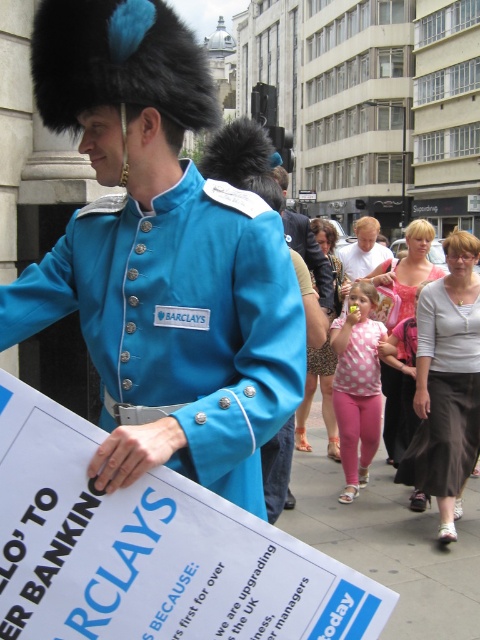
How distant is pink fabric dress at center from light brown hair at center?

The distance of pink fabric dress at center from light brown hair at center is 96.15 centimeters.

Is point (376, 284) closer to viewer compared to point (360, 228)?

Yes, point (376, 284) is closer to viewer.

Locate an element on the screen. The height and width of the screenshot is (640, 480). pink fabric dress at center is located at coordinates (408, 269).

Is light gray cotton skirt at lower right taller than pink fabric dress at center?

No, light gray cotton skirt at lower right is not taller than pink fabric dress at center.

Is point (460, 316) positioned behind point (404, 301)?

That is False.

Between point (471, 257) and point (437, 272), which one is positioned behind?

Point (437, 272)

Locate an element on the screen. light gray cotton skirt at lower right is located at coordinates (446, 385).

Who is more forward, (391, 384) or (308, 352)?

Point (308, 352) is more forward.

Does pink fabric dress at center come in front of leopard print dress at center?

Yes, it is in front of leopard print dress at center.

Where is `pink fabric dress at center`? pink fabric dress at center is located at coordinates (408, 269).